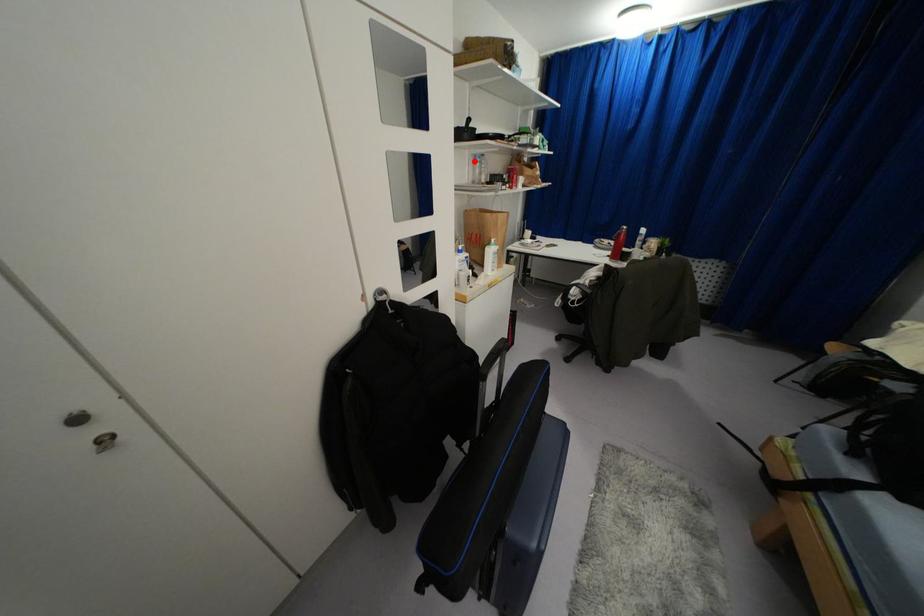
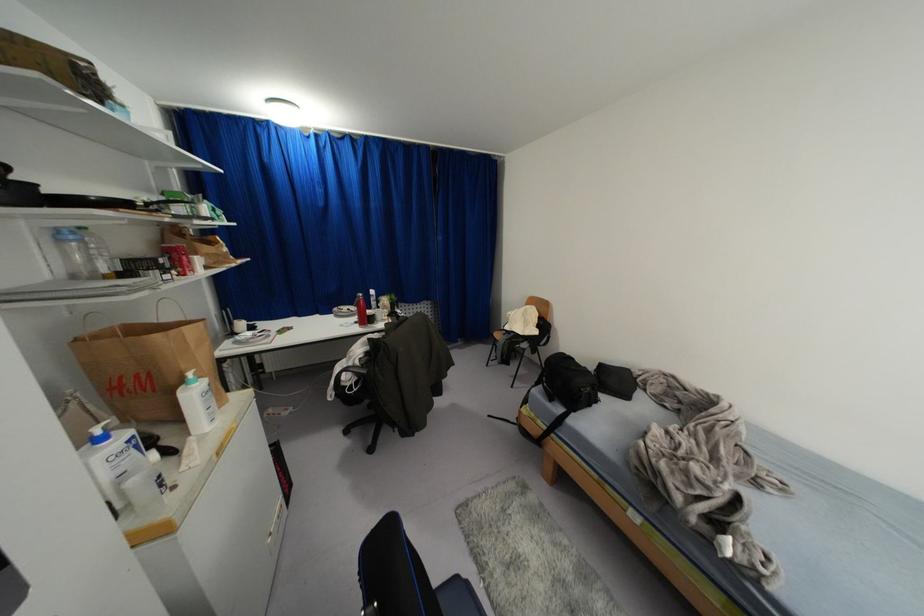
The point at the highlighted location is marked in the first image. Where is the corresponding point in the second image?

(62, 240)